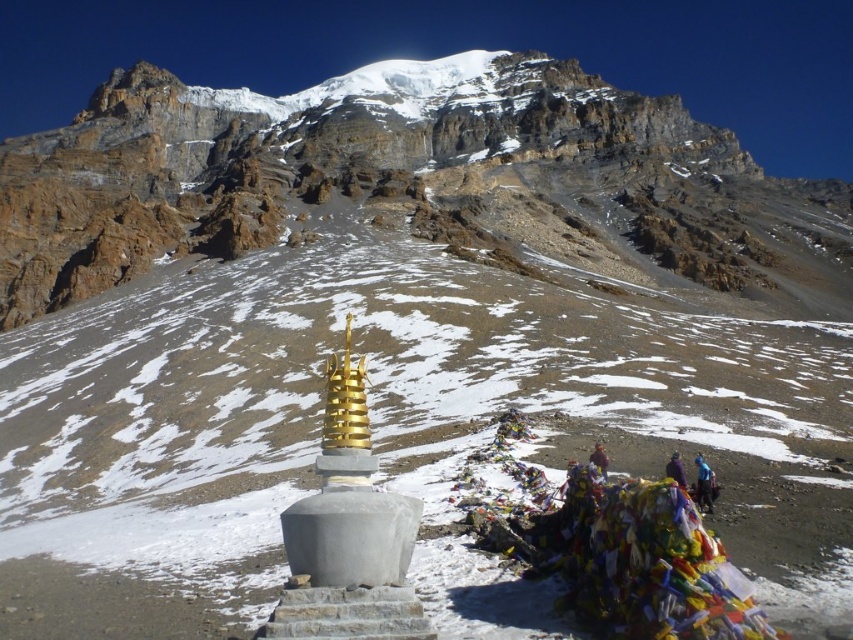
From the picture: Who is higher up, purple fabric at lower right or brown leather jacket at lower right?

brown leather jacket at lower right

Is purple fabric at lower right smaller than brown leather jacket at lower right?

Correct, purple fabric at lower right occupies less space than brown leather jacket at lower right.

Which is behind, point (685, 480) or point (601, 456)?

Positioned behind is point (685, 480).

This screenshot has height=640, width=853. What are the coordinates of `purple fabric at lower right` in the screenshot? It's located at (676, 470).

Image resolution: width=853 pixels, height=640 pixels. Describe the element at coordinates (703, 484) in the screenshot. I see `blue fabric at lower right` at that location.

Is point (701, 502) less distant than point (683, 488)?

No, (701, 502) is behind (683, 488).

Between point (709, 477) and point (670, 460), which one is positioned in front?

Point (709, 477)

Identify the location of blue fabric at lower right. This screenshot has height=640, width=853. (703, 484).

This screenshot has height=640, width=853. Describe the element at coordinates (703, 484) in the screenshot. I see `blue fabric at lower right` at that location.

Is point (705, 493) closer to camera compared to point (596, 449)?

That is True.

Is point (700, 488) positioned after point (589, 460)?

That is False.

Locate an element on the screen. This screenshot has width=853, height=640. blue fabric at lower right is located at coordinates (703, 484).